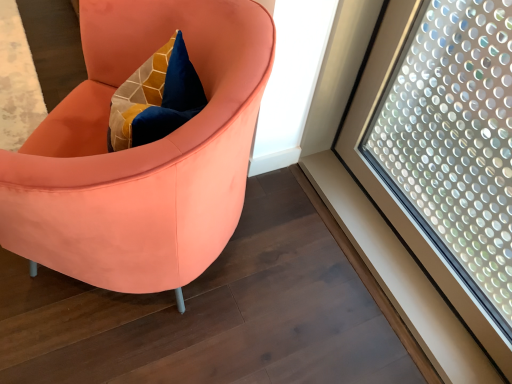
What is the approximate height of coral fabric chair at left?

32.12 inches.

What do you see at coordinates (141, 153) in the screenshot? Image resolution: width=512 pixels, height=384 pixels. I see `coral fabric chair at left` at bounding box center [141, 153].

The height and width of the screenshot is (384, 512). In order to click on coral fabric chair at left in this screenshot , I will do `click(141, 153)`.

Locate an element on the screen. This screenshot has width=512, height=384. coral fabric chair at left is located at coordinates (141, 153).